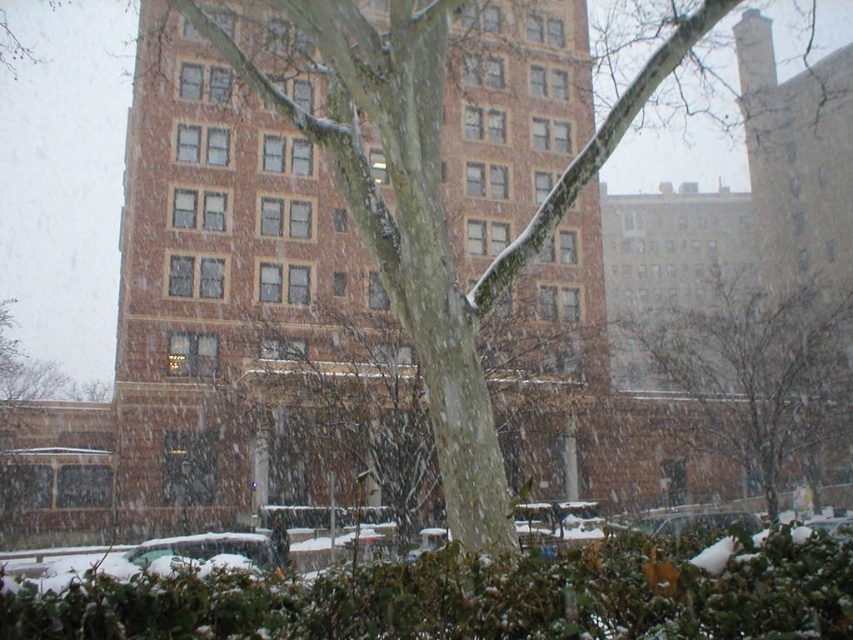
Does green leafy bush at lower center have a greater height compared to metallic silver car at lower left?

No.

Describe the element at coordinates (474, 598) in the screenshot. I see `green leafy bush at lower center` at that location.

This screenshot has height=640, width=853. Find the location of `green leafy bush at lower center`. green leafy bush at lower center is located at coordinates (474, 598).

Is green leafy bush at lower center below smooth bark tree at center?

No.

Who is lower down, green leafy bush at lower center or smooth bark tree at center?

smooth bark tree at center is lower down.

Which is behind, point (589, 624) or point (666, 310)?

Positioned behind is point (666, 310).

This screenshot has width=853, height=640. Identify the location of green leafy bush at lower center. (474, 598).

Can you confirm if smooth bark tree at center is positioned below metallic silver car at lower left?

Incorrect, smooth bark tree at center is not positioned below metallic silver car at lower left.

Can you confirm if smooth bark tree at center is positioned above metallic silver car at lower left?

Yes, smooth bark tree at center is above metallic silver car at lower left.

Is point (799, 385) closer to camera compared to point (157, 560)?

No.

The height and width of the screenshot is (640, 853). What are the coordinates of `smooth bark tree at center` in the screenshot? It's located at (756, 376).